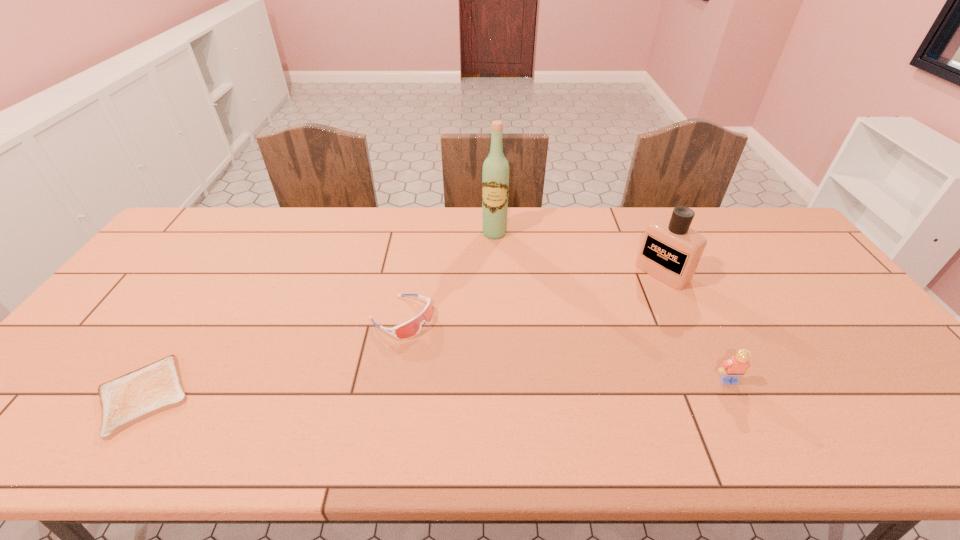
At what (x,y) coordinates should I click in order to perform the action: click on free space that is in between the perfume and the tallest object. Please return your answer as a coordinate pair (x, y). The image size is (960, 540). Looking at the image, I should click on point(578,253).

Identify the location of free point between the Lego and the leftmost object. This screenshot has height=540, width=960. (436, 388).

At what (x,y) coordinates should I click in order to perform the action: click on free space between the Lego and the shortest object. Please return your answer as a coordinate pair (x, y). The image size is (960, 540). Looking at the image, I should click on (436, 388).

The image size is (960, 540). Identify the location of vacant space in between the tallest object and the third shortest object. (612, 307).

Locate an element on the screen. free space between the second farthest object and the third tallest object is located at coordinates (695, 327).

Identify the location of free spot between the wine bottle and the third farthest object. This screenshot has height=540, width=960. (447, 275).

Locate an element on the screen. The height and width of the screenshot is (540, 960). object identified as the second closest to the shortest object is located at coordinates (495, 175).

Find the location of a particular element. The image size is (960, 540). object identified as the closest to the third nearest object is located at coordinates (495, 175).

The height and width of the screenshot is (540, 960). Identify the location of vacant space that satisfies the following two spatial constraints: 1. on the back side of the shortest object; 2. on the left side of the goggles. (194, 318).